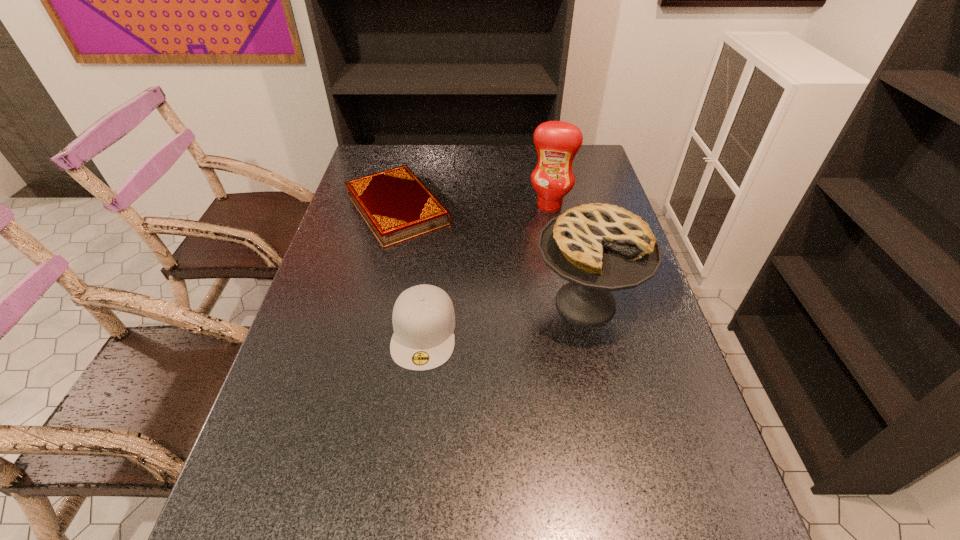
Image resolution: width=960 pixels, height=540 pixels. Identify the location of free region at the right edge of the desktop. (641, 456).

This screenshot has height=540, width=960. Find the location of `free space between the pie and the hardback book`. free space between the pie and the hardback book is located at coordinates (492, 256).

I want to click on free point between the shortest object and the cap, so click(x=411, y=271).

Identify the location of vacant area that lies between the pie and the hardback book. The width and height of the screenshot is (960, 540). (492, 256).

Identify the location of empty space that is in between the cap and the hardback book. (411, 271).

Locate an element on the screen. The image size is (960, 540). vacant area that lies between the shortest object and the pie is located at coordinates (492, 256).

Find the location of a particular element. free space between the shortest object and the condiment is located at coordinates (473, 207).

This screenshot has width=960, height=540. I want to click on vacant region between the third tallest object and the shortest object, so click(x=411, y=271).

Where is `object that ranks as the third closest to the cap`? The width and height of the screenshot is (960, 540). object that ranks as the third closest to the cap is located at coordinates (557, 143).

You are a GUI agent. You are given a task and a screenshot of the screen. Output one action in this format:
    pyautogui.click(x=<x>, y=<y>)
    Task: Click on the object that stands as the third closest to the pie
    
    Given the screenshot: What is the action you would take?
    pyautogui.click(x=557, y=143)